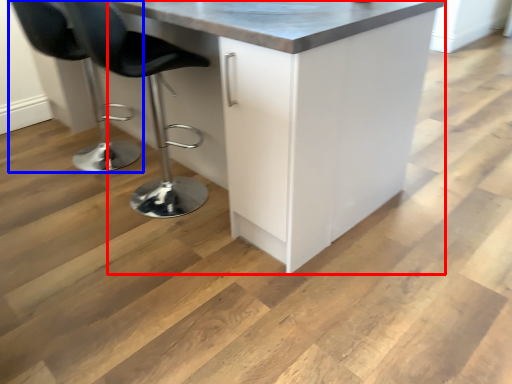
Question: Which object appears farthest to the camera in this image, cabinetry (highlighted by a red box) or chair (highlighted by a blue box)?

Choices:
 (A) cabinetry
 (B) chair

Answer: (B)